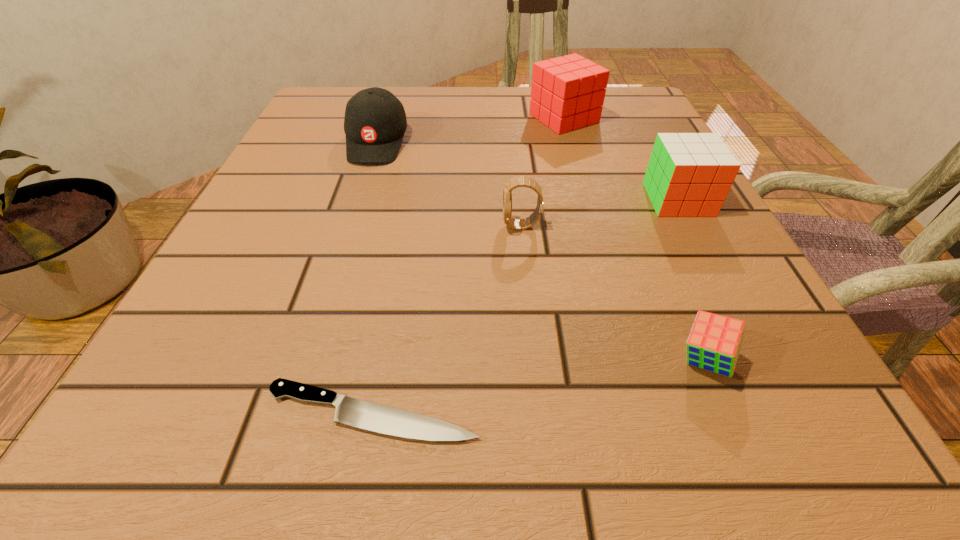
Locate an element on the screen. This screenshot has width=960, height=540. free space between the farthest cube and the nearest cube is located at coordinates (635, 239).

You are a GUI agent. You are given a task and a screenshot of the screen. Output one action in this format:
    pyautogui.click(x=<x>, y=<y>)
    Task: Click on the free space between the second shortest object and the baseball cap
    The width and height of the screenshot is (960, 540).
    Given the screenshot: What is the action you would take?
    coord(540,251)

Find the location of a particular element. The image size is (960, 540). vacant point located between the baseball cap and the fifth tallest object is located at coordinates (540, 251).

Image resolution: width=960 pixels, height=540 pixels. I want to click on vacant area that lies between the second shortest object and the baseball cap, so click(x=540, y=251).

I want to click on free space that is in between the baseball cap and the second farthest cube, so click(x=527, y=171).

Image resolution: width=960 pixels, height=540 pixels. In order to click on empty space that is in between the steak knife and the second farthest cube in this screenshot , I will do `click(525, 306)`.

Where is `vacant area between the shortest object and the fourth object from right to left`? The width and height of the screenshot is (960, 540). vacant area between the shortest object and the fourth object from right to left is located at coordinates (447, 319).

This screenshot has width=960, height=540. In order to click on vacant point located between the shortest cube and the second nearest cube in this screenshot , I will do (x=691, y=280).

What are the coordinates of `object that can be found as the third closest to the farthest cube` in the screenshot? It's located at (519, 181).

Locate an element on the screen. The height and width of the screenshot is (540, 960). object that is the closest to the shortest cube is located at coordinates (349, 411).